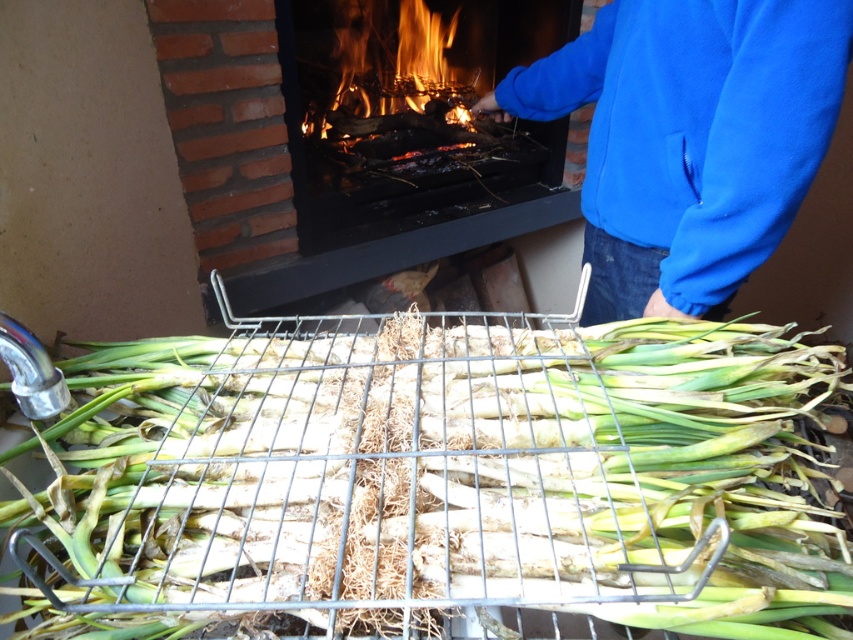
Based on the scene description, where is the green fibrous vegetable at center located in terms of its 2D coordinates?

The green fibrous vegetable at center is located at the 2D coordinates of point (448, 477).

You are a chef preparing ingredients for a dish. You have a green fibrous vegetable at center and a blue fleece jacket at upper right. Which item is closer to the oven where the fire is active?

The green fibrous vegetable at center is closer to the oven where the fire is active because it is positioned at the center, while the blue fleece jacket at upper right is located further away.